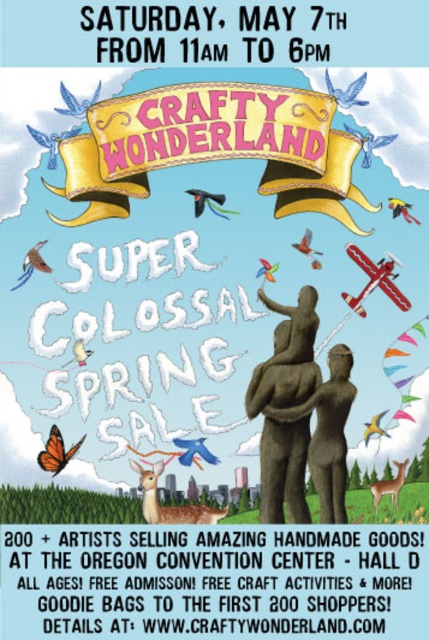
Question: Where is orange paper kite at lower left located in relation to brown furry deer at lower right in the image?

Choices:
 (A) left
 (B) right

Answer: (A)

Question: Estimate the real-world distances between objects in this image. Which object is farther from the matte stone statue at center?

Choices:
 (A) red matte kite at upper right
 (B) brown furry deer at lower right

Answer: (A)

Question: Does red matte airplane at upper right appear over red matte kite at upper right?

Choices:
 (A) no
 (B) yes

Answer: (A)

Question: Considering the real-world distances, which object is farthest from the orange paper kite at lower left?

Choices:
 (A) matte stone statue at center
 (B) translucent plastic kite at center
 (C) matte brown kite at upper left
 (D) yellow paper kite at center

Answer: (D)

Question: Which of the following is the closest to the observer?

Choices:
 (A) matte stone statue at center
 (B) matte brown statue at center
 (C) red matte kite at upper right

Answer: (A)

Question: Does matte stone statue at center appear over red matte kite at upper right?

Choices:
 (A) no
 (B) yes

Answer: (A)